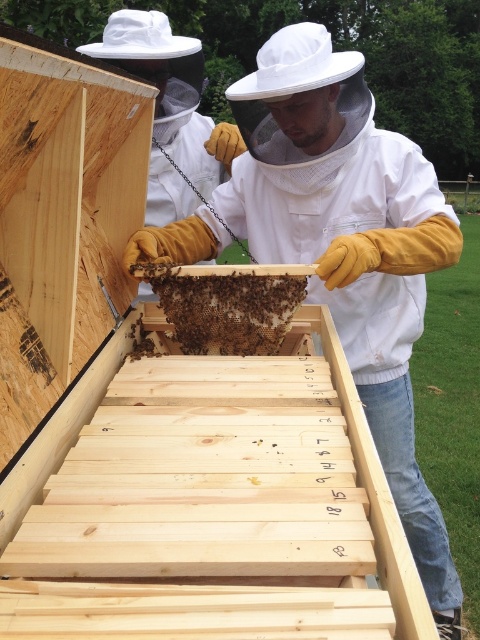
You are a beekeeper and you need to locate the white mesh veil at center in the image. What are its coordinates?

The white mesh veil at center is located at coordinates [350,248].

You are a beekeeper trying to inspect the honeycomb. You see the white mesh veil at center and the brown honeycomb at center. Which object is closer to your face?

The white mesh veil at center is positioned under the brown honeycomb at center, so the honeycomb is above the veil. Since the veil is part of the protective gear covering the face, the brown honeycomb at center is closer to your face than the veil itself.